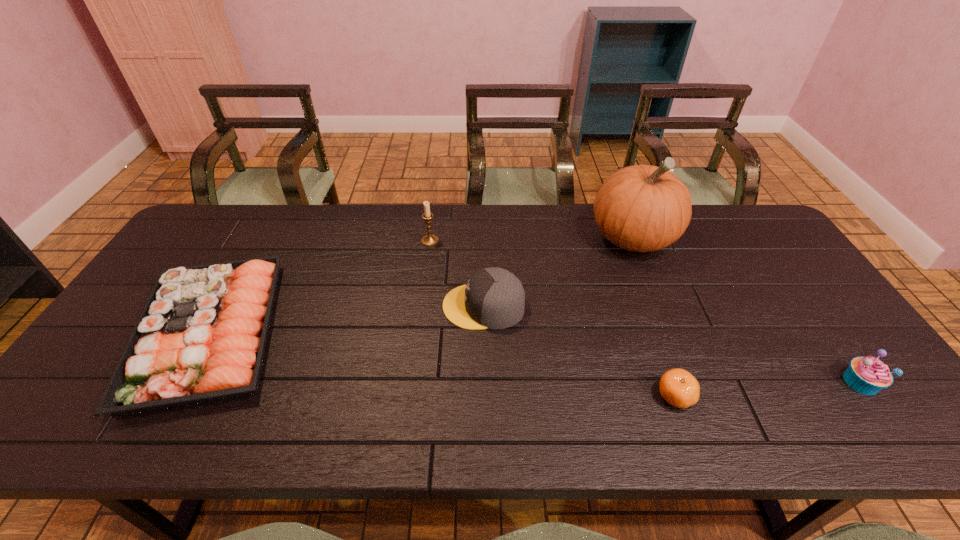
The width and height of the screenshot is (960, 540). Find the location of `empty space that is in between the cap and the muffin`. empty space that is in between the cap and the muffin is located at coordinates 672,344.

This screenshot has height=540, width=960. I want to click on unoccupied position between the muffin and the clementine, so click(x=768, y=389).

At what (x,y) coordinates should I click in order to perform the action: click on free point between the candle holder and the pumpkin. Please return your answer as a coordinate pair (x, y). This screenshot has height=540, width=960. Looking at the image, I should click on (531, 240).

The width and height of the screenshot is (960, 540). I want to click on free space that is in between the pumpkin and the clementine, so click(654, 317).

Identify the location of free space between the candle holder and the leftmost object. Image resolution: width=960 pixels, height=540 pixels. (320, 287).

The width and height of the screenshot is (960, 540). I want to click on unoccupied position between the cap and the pumpkin, so click(558, 272).

Find the location of a particular element. This screenshot has height=540, width=960. vacant space that is in between the pumpkin and the muffin is located at coordinates (747, 310).

Identify the location of object that is the third closest to the leftmost object. (642, 208).

This screenshot has width=960, height=540. In order to click on object that can be found as the closest to the pumpkin in this screenshot , I will do `click(494, 298)`.

Where is `blank area in the image that satisfies the following two spatial constraints: 1. on the front-facing side of the clementine; 2. on the left side of the cap`? The width and height of the screenshot is (960, 540). blank area in the image that satisfies the following two spatial constraints: 1. on the front-facing side of the clementine; 2. on the left side of the cap is located at coordinates (485, 396).